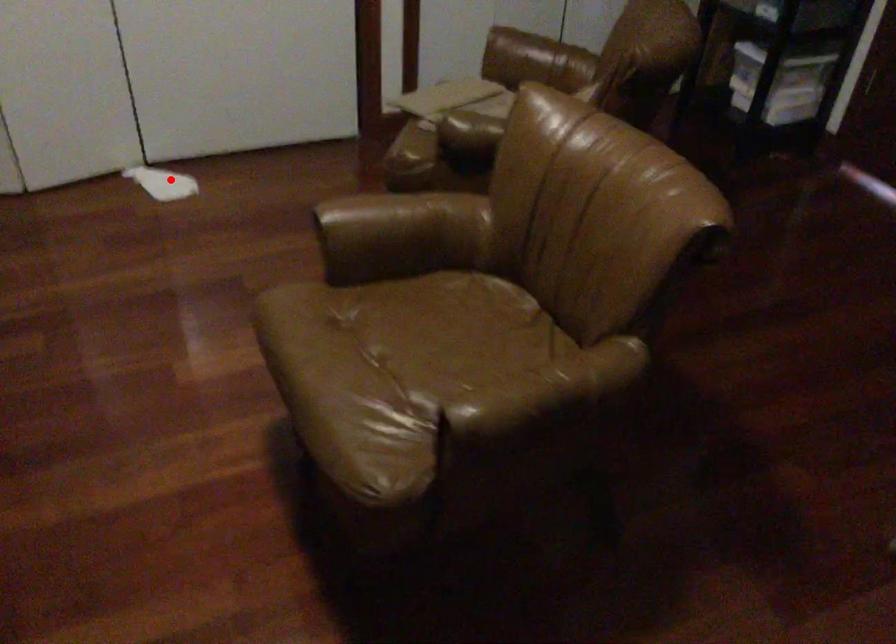
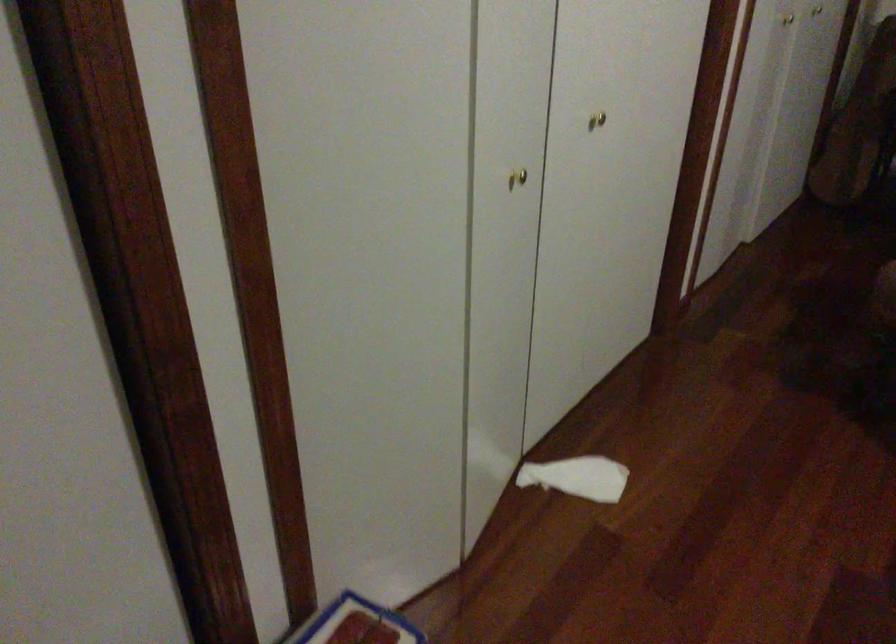
Find the pixel in the second image that matches the highlighted location in the first image.

(578, 477)